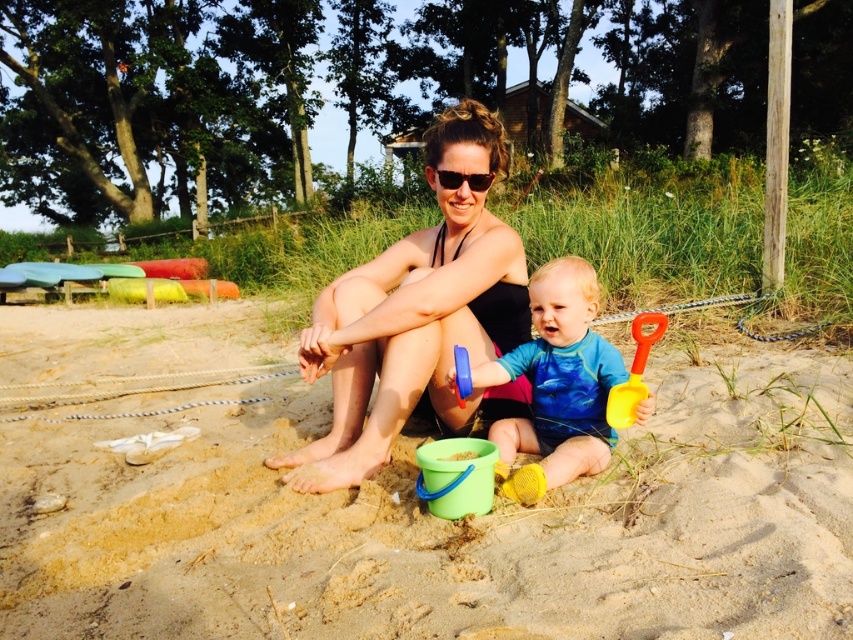
Question: Among these objects, which one is farthest from the camera?

Choices:
 (A) yellow plastic shovel at lower right
 (B) blue plastic bucket at center
 (C) green plastic bucket at lower center
 (D) blue rubber toy at center

Answer: (B)

Question: Is blue rubber toy at center positioned at the back of black plastic sunglasses at center?

Choices:
 (A) yes
 (B) no

Answer: (B)

Question: Which point is closer to the camera?

Choices:
 (A) green plastic bucket at lower center
 (B) blue rubber toy at center

Answer: (A)

Question: Which object is positioned farthest from the green plastic bucket at lower center?

Choices:
 (A) black plastic sunglasses at center
 (B) blue plastic bucket at center
 (C) yellow plastic shovel at lower right

Answer: (A)

Question: Does yellow plastic shovel at lower right appear under black plastic sunglasses at center?

Choices:
 (A) no
 (B) yes

Answer: (B)

Question: Is green plastic bucket at center smaller than black matte swimsuit at center?

Choices:
 (A) yes
 (B) no

Answer: (A)